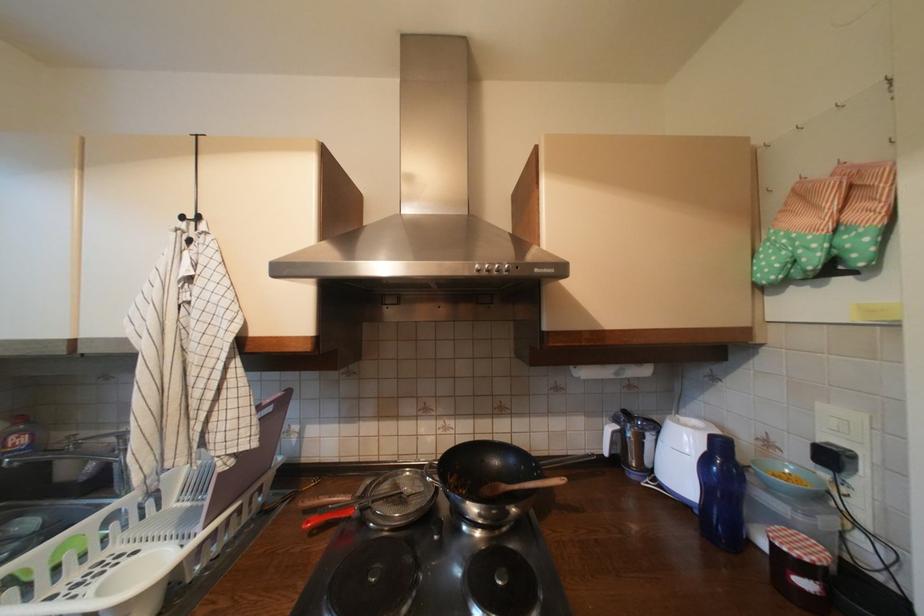
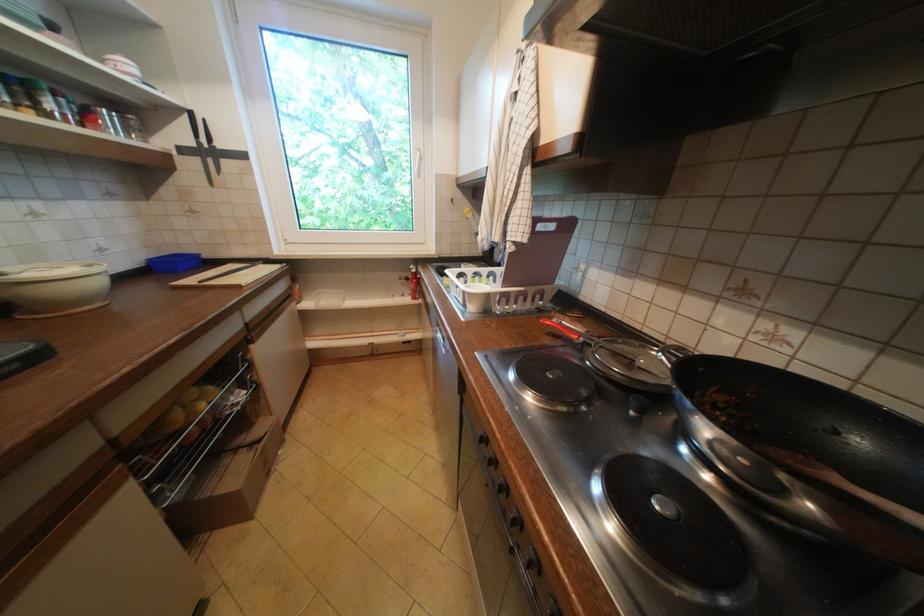
Locate, in the second image, the point that corresponds to the point at 482,509 in the first image.

(715, 430)